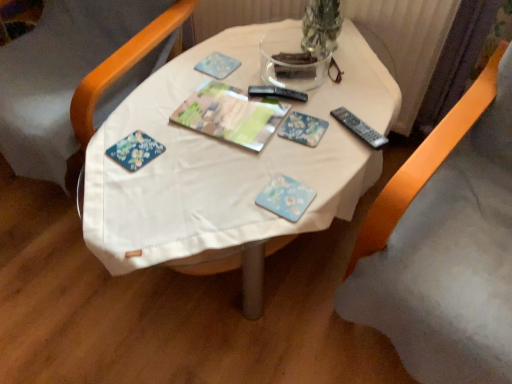
The height and width of the screenshot is (384, 512). In order to click on vacant area that lies between blue floral coaster at center, arranged as the first paperback book when ordered from the bottom, and floral-patterned paper at center-left in this screenshot , I will do `click(210, 172)`.